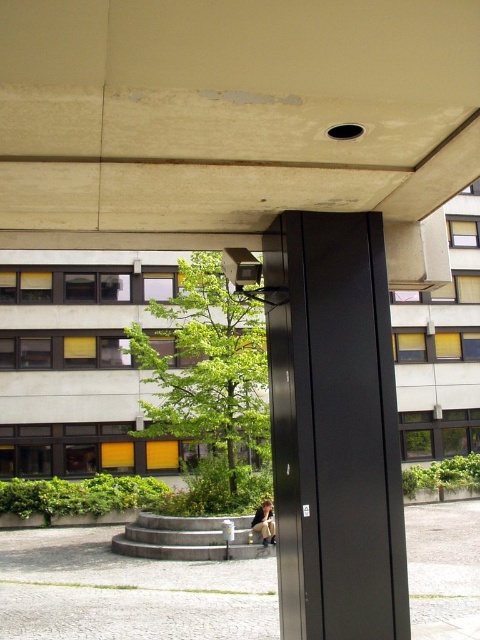
Question: Is matte black pillar at center wider than denim jacket at lower center?

Choices:
 (A) yes
 (B) no

Answer: (A)

Question: Among these points, which one is farthest from the camera?

Choices:
 (A) (264, 532)
 (B) (358, 598)

Answer: (A)

Question: Which object is closer to the camera taking this photo?

Choices:
 (A) denim jacket at lower center
 (B) matte black pillar at center

Answer: (B)

Question: Is matte black pillar at center above denim jacket at lower center?

Choices:
 (A) yes
 (B) no

Answer: (A)

Question: Observing the image, what is the correct spatial positioning of matte black pillar at center in reference to denim jacket at lower center?

Choices:
 (A) left
 (B) right

Answer: (B)